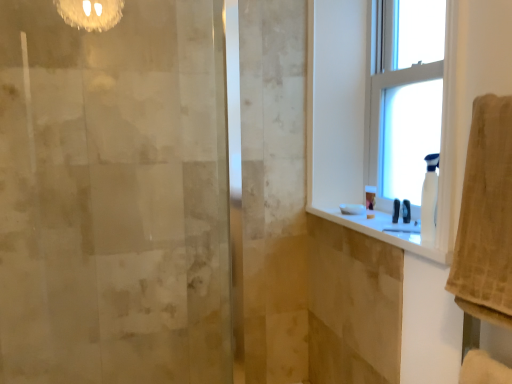
This screenshot has width=512, height=384. What do you see at coordinates (486, 216) in the screenshot?
I see `beige textured towel at right` at bounding box center [486, 216].

Where is `beige textured towel at right`? The image size is (512, 384). beige textured towel at right is located at coordinates (486, 216).

This screenshot has height=384, width=512. Describe the element at coordinates (405, 93) in the screenshot. I see `clear glass window at upper right, the first window from the right` at that location.

Describe the element at coordinates (365, 119) in the screenshot. I see `white plastic window at upper right, which is the first window in left-to-right order` at that location.

Where is `white glossy counter top at upper right`? This screenshot has width=512, height=384. white glossy counter top at upper right is located at coordinates (392, 233).

Does point (483, 245) come behind point (430, 210)?

No, it is not.

Is beige textured towel at right facing towards white plastic spray bottle at right?

No, beige textured towel at right is not oriented towards white plastic spray bottle at right.

Looking at their sizes, would you say beige textured towel at right is wider or thinner than white plastic spray bottle at right?

In the image, beige textured towel at right appears to be wider than white plastic spray bottle at right.

In terms of width, does white plastic spray bottle at right look wider or thinner when compared to white glossy counter top at upper right?

white plastic spray bottle at right is thinner than white glossy counter top at upper right.

Considering the positions of point (426, 230) and point (418, 248), is point (426, 230) closer or farther from the camera than point (418, 248)?

Point (426, 230) is closer to the camera than point (418, 248).

Considering the relative sizes of white plastic spray bottle at right and white glossy counter top at upper right in the image provided, is white plastic spray bottle at right taller than white glossy counter top at upper right?

Correct, white plastic spray bottle at right is much taller as white glossy counter top at upper right.

Considering the relative positions of white plastic window at upper right, the second window in the right-to-left sequence, and clear glass window at upper right, the 2th window when ordered from left to right, in the image provided, is white plastic window at upper right, the second window in the right-to-left sequence, to the left of clear glass window at upper right, the 2th window when ordered from left to right, from the viewer's perspective?

Yes, white plastic window at upper right, the second window in the right-to-left sequence, is to the left of clear glass window at upper right, the 2th window when ordered from left to right.

Considering the sizes of objects white plastic window at upper right, the second window in the right-to-left sequence, and clear glass window at upper right, the first window from the right, in the image provided, who is wider, white plastic window at upper right, the second window in the right-to-left sequence, or clear glass window at upper right, the first window from the right,?

clear glass window at upper right, the first window from the right.

From the image's perspective, is white plastic window at upper right, the second window in the right-to-left sequence, beneath clear glass window at upper right, the first window from the right?

Indeed, from the image's perspective, white plastic window at upper right, the second window in the right-to-left sequence, is shown beneath clear glass window at upper right, the first window from the right.

Who is taller, white plastic window at upper right, the second window in the right-to-left sequence, or clear glass window at upper right, the first window from the right?

With more height is white plastic window at upper right, the second window in the right-to-left sequence.

From a real-world perspective, is clear glass window at upper right, the 2th window when ordered from left to right, positioned above or below white plastic spray bottle at right?

clear glass window at upper right, the 2th window when ordered from left to right, is above white plastic spray bottle at right.

At what (x,y) coordinates should I click in order to perform the action: click on toiletry below the clear glass window at upper right, the first window from the right (from the image's perspective). Please return your answer as a coordinate pair (x, y). The height and width of the screenshot is (384, 512). Looking at the image, I should click on (429, 200).

Considering the positions of objects clear glass window at upper right, the first window from the right, and white plastic spray bottle at right in the image provided, who is more to the right, clear glass window at upper right, the first window from the right, or white plastic spray bottle at right?

Positioned to the right is clear glass window at upper right, the first window from the right.

From the picture: Considering the sizes of clear glass window at upper right, the 2th window when ordered from left to right, and white plastic spray bottle at right in the image, is clear glass window at upper right, the 2th window when ordered from left to right, bigger or smaller than white plastic spray bottle at right?

Considering their sizes, clear glass window at upper right, the 2th window when ordered from left to right, takes up more space than white plastic spray bottle at right.

Is clear glass window at upper right, the 2th window when ordered from left to right, thinner than white plastic window at upper right, the second window in the right-to-left sequence?

Incorrect, the width of clear glass window at upper right, the 2th window when ordered from left to right, is not less than that of white plastic window at upper right, the second window in the right-to-left sequence.

Where is `window in front of the clear glass window at upper right, the first window from the right`? window in front of the clear glass window at upper right, the first window from the right is located at coordinates (365, 119).

Would you say clear glass window at upper right, the first window from the right, is outside white plastic window at upper right, the second window in the right-to-left sequence?

clear glass window at upper right, the first window from the right, lies outside white plastic window at upper right, the second window in the right-to-left sequence,'s area.

Is clear glass window at upper right, the first window from the right, not near white plastic window at upper right, which is the first window in left-to-right order?

Actually, clear glass window at upper right, the first window from the right, and white plastic window at upper right, which is the first window in left-to-right order, are a little close together.

Is beige textured towel at right inside white plastic window at upper right, the second window in the right-to-left sequence?

No, beige textured towel at right is located outside of white plastic window at upper right, the second window in the right-to-left sequence.

From a real-world perspective, does white plastic window at upper right, which is the first window in left-to-right order, stand above beige textured towel at right?

Yes, from a real-world perspective, white plastic window at upper right, which is the first window in left-to-right order, is on top of beige textured towel at right.

From the image's perspective, which object appears higher, white plastic window at upper right, the second window in the right-to-left sequence, or beige textured towel at right?

From the image's view, white plastic window at upper right, the second window in the right-to-left sequence, is above.

Does white plastic window at upper right, which is the first window in left-to-right order, appear on the left side of beige textured towel at right?

Yes, white plastic window at upper right, which is the first window in left-to-right order, is to the left of beige textured towel at right.

How many degrees apart are the facing directions of white plastic window at upper right, the second window in the right-to-left sequence, and white glossy counter top at upper right?

They differ by 0.154 degrees in their facing directions.

Does white plastic window at upper right, which is the first window in left-to-right order, come in front of white glossy counter top at upper right?

Yes, it is in front of white glossy counter top at upper right.

From the image's perspective, is white plastic window at upper right, which is the first window in left-to-right order, under white glossy counter top at upper right?

Actually, white plastic window at upper right, which is the first window in left-to-right order, appears above white glossy counter top at upper right in the image.

Considering the points (378, 97) and (381, 221), which point is in front, point (378, 97) or point (381, 221)?

The point (381, 221) is closer to the camera.

Where is `toiletry located underneath the beige textured towel at right (from a real-world perspective)`? This screenshot has height=384, width=512. toiletry located underneath the beige textured towel at right (from a real-world perspective) is located at coordinates (429, 200).

Find the location of `counter top below the white plastic spray bottle at right (from the image's perspective)`. counter top below the white plastic spray bottle at right (from the image's perspective) is located at coordinates (392, 233).

Based on their spatial positions, is white plastic spray bottle at right or clear glass window at upper right, the first window from the right, further from white glossy counter top at upper right?

Among the two, clear glass window at upper right, the first window from the right, is located further to white glossy counter top at upper right.

Estimate the real-world distances between objects in this image. Which object is further from white plastic spray bottle at right, beige textured towel at right or white plastic window at upper right, which is the first window in left-to-right order?

white plastic window at upper right, which is the first window in left-to-right order, is further to white plastic spray bottle at right.

Looking at this image, looking at the image, which one is located closer to beige textured towel at right, white plastic window at upper right, which is the first window in left-to-right order, or white plastic spray bottle at right?

white plastic spray bottle at right is positioned closer to the anchor beige textured towel at right.

Based on their spatial positions, is white plastic window at upper right, the second window in the right-to-left sequence, or white glossy counter top at upper right closer to beige textured towel at right?

white glossy counter top at upper right is positioned closer to the anchor beige textured towel at right.

In the scene shown: Considering their positions, is beige textured towel at right positioned further to clear glass window at upper right, the 2th window when ordered from left to right, than white plastic spray bottle at right?

Among the two, beige textured towel at right is located further to clear glass window at upper right, the 2th window when ordered from left to right.

Which object lies further to the anchor point clear glass window at upper right, the first window from the right, white plastic window at upper right, which is the first window in left-to-right order, or white plastic spray bottle at right?

white plastic spray bottle at right is further to clear glass window at upper right, the first window from the right.

Which object lies further to the anchor point white plastic spray bottle at right, white plastic window at upper right, the second window in the right-to-left sequence, or white glossy counter top at upper right?

white plastic window at upper right, the second window in the right-to-left sequence, is further to white plastic spray bottle at right.

Based on their spatial positions, is beige textured towel at right or white glossy counter top at upper right closer to white plastic window at upper right, the second window in the right-to-left sequence?

Based on the image, white glossy counter top at upper right appears to be nearer to white plastic window at upper right, the second window in the right-to-left sequence.

The width and height of the screenshot is (512, 384). I want to click on toiletry between beige textured towel at right and clear glass window at upper right, the first window from the right, from front to back, so click(x=429, y=200).

The height and width of the screenshot is (384, 512). In order to click on counter top between beige textured towel at right and white plastic spray bottle at right in the front-back direction in this screenshot , I will do pyautogui.click(x=392, y=233).

This screenshot has height=384, width=512. Find the location of `window that lies between clear glass window at upper right, the first window from the right, and white glossy counter top at upper right from top to bottom`. window that lies between clear glass window at upper right, the first window from the right, and white glossy counter top at upper right from top to bottom is located at coordinates (365, 119).

Where is `window between beige textured towel at right and white plastic spray bottle at right from front to back`? window between beige textured towel at right and white plastic spray bottle at right from front to back is located at coordinates (365, 119).